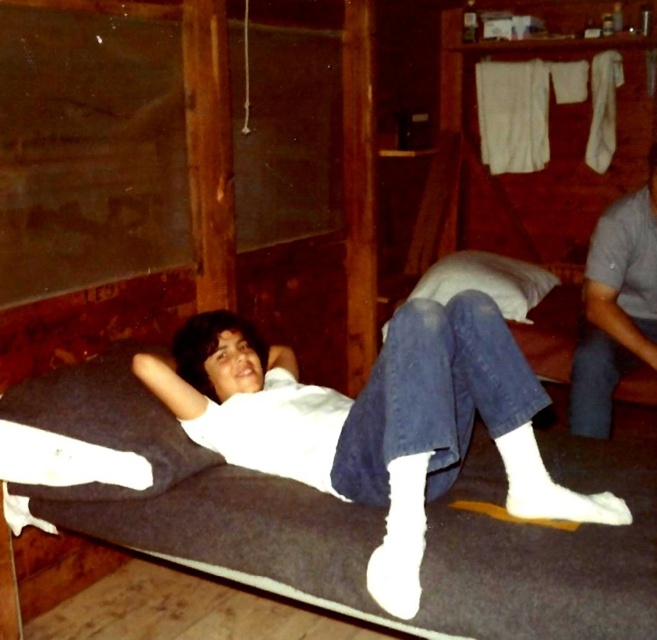
Question: Is gray cotton shirt at right to the left of white soft pillow at center from the viewer's perspective?

Choices:
 (A) yes
 (B) no

Answer: (B)

Question: Observing the image, what is the correct spatial positioning of dark blue fabric pillow at lower left in reference to gray cotton shirt at right?

Choices:
 (A) left
 (B) right

Answer: (A)

Question: Which of the following is the farthest from the observer?

Choices:
 (A) gray cotton shirt at right
 (B) white matte shirt at center
 (C) dark blue fabric pillow at lower left
 (D) white soft pillow at center

Answer: (D)

Question: Estimate the real-world distances between objects in this image. Which object is farther from the dark blue fabric pillow at lower left?

Choices:
 (A) white matte shirt at center
 (B) gray cotton shirt at right

Answer: (B)

Question: Does gray cotton shirt at right have a lesser width compared to white soft pillow at center?

Choices:
 (A) no
 (B) yes

Answer: (B)

Question: Which point is closer to the camera?

Choices:
 (A) white matte shirt at center
 (B) gray cotton shirt at right
 (C) dark blue fabric pillow at lower left
 (D) white soft pillow at center

Answer: (A)